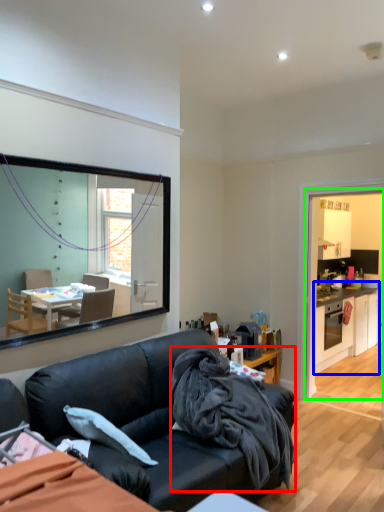
Question: Considering the real-world distances, which object is farthest from blanket (highlighted by a red box)? cabinetry (highlighted by a blue box) or dresser (highlighted by a green box)?

Choices:
 (A) cabinetry
 (B) dresser

Answer: (B)